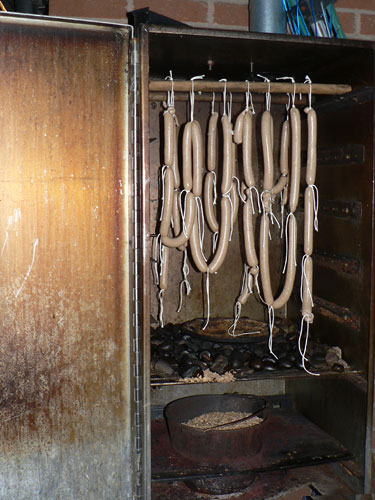
The height and width of the screenshot is (500, 375). I want to click on middle shelf, so click(x=309, y=435).